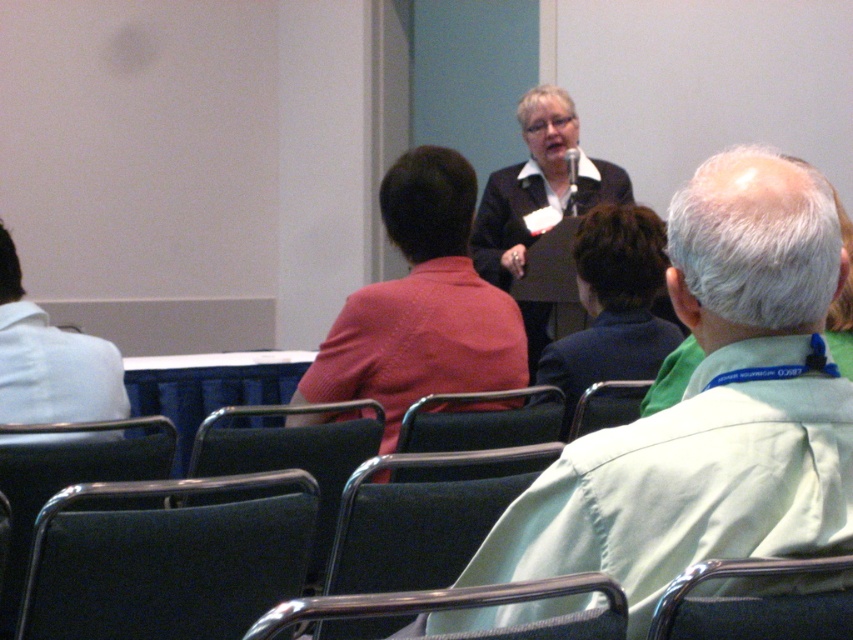
Which is below, light green fabric jacket at center or metallic silver chair at lower right?

metallic silver chair at lower right is below.

Between point (618, 563) and point (666, 625), which one is positioned behind?

Positioned behind is point (666, 625).

The image size is (853, 640). Identify the location of light green fabric jacket at center. (711, 406).

Does white fabric shirt at left have a lesser width compared to dark blue fabric chair at lower left?

Yes, white fabric shirt at left is thinner than dark blue fabric chair at lower left.

Who is more forward, (93, 378) or (85, 467)?

Positioned in front is point (85, 467).

Which is behind, point (12, 362) or point (59, 458)?

Point (12, 362)

In order to click on white fabric shirt at left in this screenshot , I will do `click(50, 360)`.

What do you see at coordinates (421, 305) in the screenshot? The width and height of the screenshot is (853, 640). I see `knitted red sweater at center` at bounding box center [421, 305].

Does knitted red sweater at center have a lesser width compared to black leather chair at center?

No, knitted red sweater at center is not thinner than black leather chair at center.

Where is `knitted red sweater at center`? knitted red sweater at center is located at coordinates (421, 305).